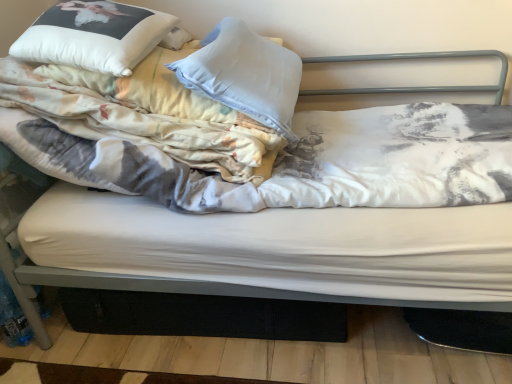
Question: Which is correct: white soft pillow at upper left, which is the 2th pillow from right to left, is inside printed cotton blanket at left, or outside of it?

Choices:
 (A) inside
 (B) outside

Answer: (A)

Question: Considering the positions of white soft pillow at upper left, which is the 1th pillow from left to right, and printed cotton blanket at left in the image, is white soft pillow at upper left, which is the 1th pillow from left to right, bigger or smaller than printed cotton blanket at left?

Choices:
 (A) small
 (B) big

Answer: (A)

Question: Which of these objects is positioned farthest from the printed cotton blanket at left?

Choices:
 (A) white soft pillow at upper left, which is the 1th pillow from left to right
 (B) white soft pillow at upper left, marked as the 1th pillow in a right-to-left arrangement

Answer: (B)

Question: Considering the real-world distances, which object is closest to the white soft pillow at upper left, acting as the 2th pillow starting from the left?

Choices:
 (A) white soft pillow at upper left, which is the 2th pillow from right to left
 (B) printed cotton blanket at left

Answer: (B)